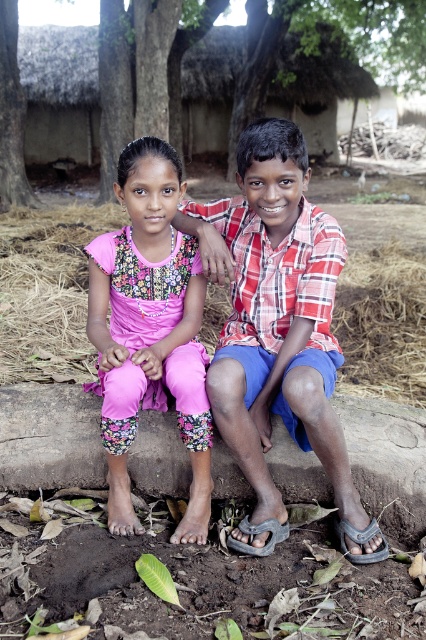
You are a photographer trying to capture a photo of the children. The floral fabric dress at center and the brown rough tree trunk at upper left are both in the frame. Which object is closer to the camera?

The floral fabric dress at center is closer to the camera because it is in front of the brown rough tree trunk at upper left.

You are a photographer aiming to capture a wide shot of the scene. Given that the floral fabric dress at center and the green leafy tree at upper center are in your frame, which object will appear narrower in the photo?

The floral fabric dress at center will appear narrower in the photo because it has a lesser width compared to the green leafy tree at upper center according to the description.